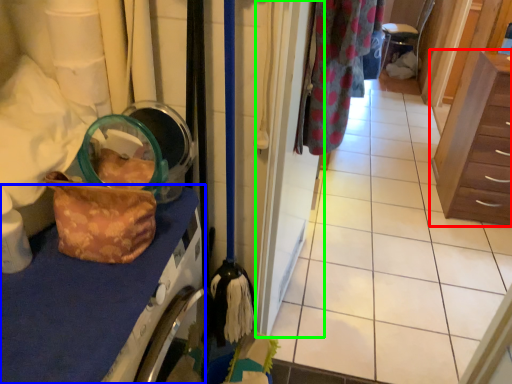
Question: Which is nearer to the chest of drawers (highlighted by a red box)? counter top (highlighted by a blue box) or door (highlighted by a green box).

Choices:
 (A) counter top
 (B) door

Answer: (B)